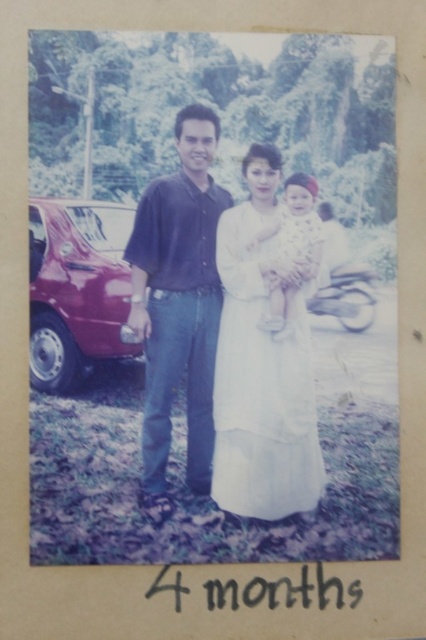
Is matte dark blue shirt at center bigger than shiny maroon car at left?

Yes.

What do you see at coordinates (178, 305) in the screenshot? The width and height of the screenshot is (426, 640). I see `matte dark blue shirt at center` at bounding box center [178, 305].

Does point (201, 330) lie behind point (115, 259)?

Yes, point (201, 330) is behind point (115, 259).

The image size is (426, 640). What are the coordinates of `matte dark blue shirt at center` in the screenshot? It's located at (178, 305).

Does point (224, 496) lie in front of point (147, 509)?

No, (224, 496) is behind (147, 509).

Between point (302, 342) and point (166, 442), which one is positioned in front?

Point (166, 442)

The height and width of the screenshot is (640, 426). Find the location of `white satin dress at center`. white satin dress at center is located at coordinates (261, 364).

Can you confirm if matte dark blue shirt at center is positioned above white fabric baby at center?

Actually, matte dark blue shirt at center is below white fabric baby at center.

Does matte dark blue shirt at center appear on the left side of white fabric baby at center?

Yes, matte dark blue shirt at center is to the left of white fabric baby at center.

Is point (195, 314) positioned after point (302, 214)?

Yes.

Locate an element on the screen. matte dark blue shirt at center is located at coordinates (178, 305).